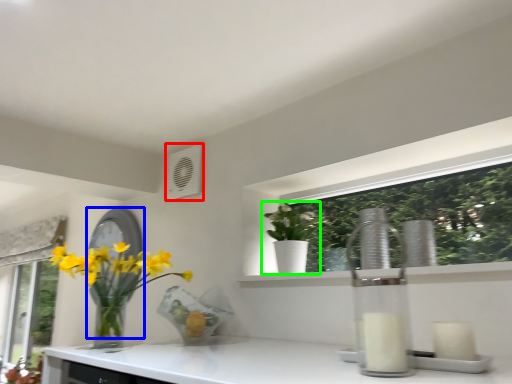
Question: Which is farther away from air conditioning (highlighted by a red box)? mirror (highlighted by a blue box) or houseplant (highlighted by a green box)?

Choices:
 (A) mirror
 (B) houseplant

Answer: (B)